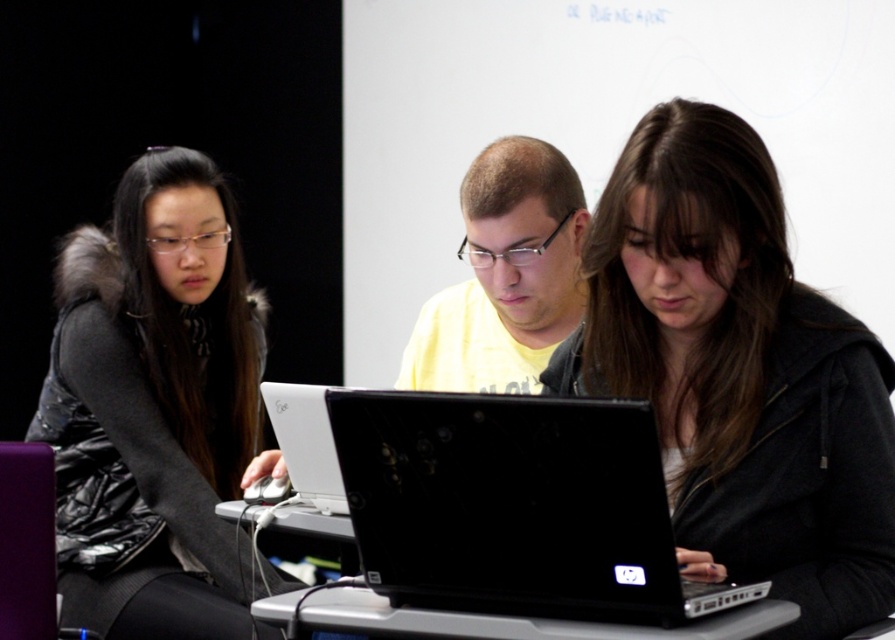
Question: Which is farther from the matte yellow shirt at center?

Choices:
 (A) silver metallic table at center
 (B) yellow matte shirt at center

Answer: (A)

Question: Is matte black hoodie at center bigger than yellow matte shirt at center?

Choices:
 (A) no
 (B) yes

Answer: (B)

Question: Where is matte black jacket at left located in relation to black matte laptop at center in the image?

Choices:
 (A) left
 (B) right

Answer: (A)

Question: Which object appears closest to the camera in this image?

Choices:
 (A) silver metallic table at center
 (B) matte yellow shirt at center
 (C) matte black hoodie at center

Answer: (A)

Question: Which point is closer to the camera taking this photo?

Choices:
 (A) (486, 632)
 (B) (209, 394)
 (C) (419, 500)
 (D) (271, 412)

Answer: (A)

Question: Is silver metallic table at center to the right of white glossy laptop at center from the viewer's perspective?

Choices:
 (A) yes
 (B) no

Answer: (A)